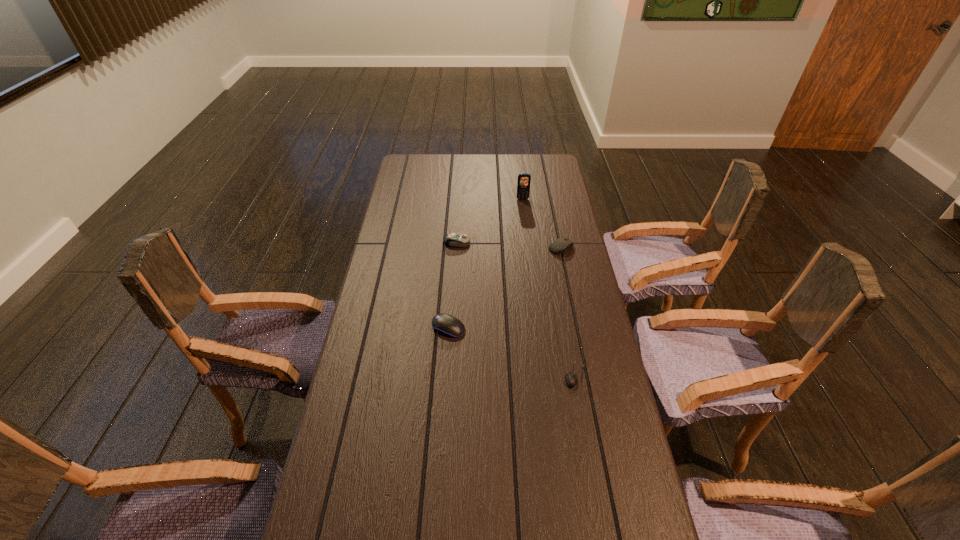
The image size is (960, 540). Identify the location of vacant space that satisfies the following two spatial constraints: 1. on the screen of the shortest object; 2. on the left side of the third object from right to left. (544, 376).

Image resolution: width=960 pixels, height=540 pixels. I want to click on free space that satisfies the following two spatial constraints: 1. on the screen of the cellular telephone; 2. on the right side of the shortest object, so click(544, 376).